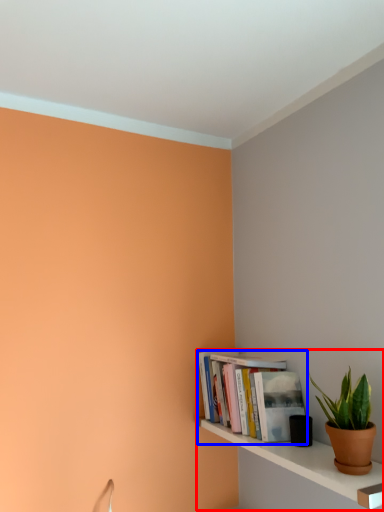
Question: Among these objects, which one is nearest to the camera, shelf (highlighted by a red box) or book (highlighted by a blue box)?

Choices:
 (A) shelf
 (B) book

Answer: (A)